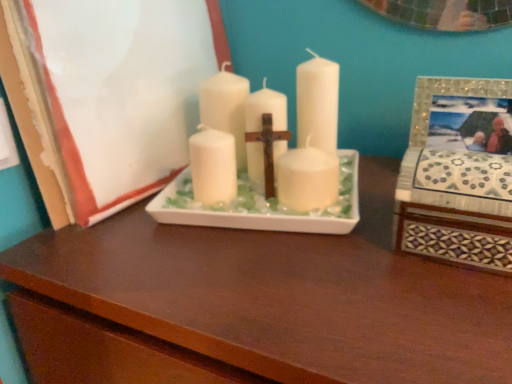
Question: Is point (439, 254) positioned closer to the camera than point (477, 279)?

Choices:
 (A) farther
 (B) closer

Answer: (A)

Question: Is mosaic tile picture frame at right, placed as the first picture frame when sorted from right to left, situated inside matte white tray at center or outside?

Choices:
 (A) inside
 (B) outside

Answer: (B)

Question: Which is nearer to the mosaic tile picture frame at right, which is the second picture frame from left to right?

Choices:
 (A) white matte candle at center
 (B) matte white tray at center
 (C) matte white picture frame at center, placed as the second picture frame when sorted from right to left

Answer: (A)

Question: Estimate the real-world distances between objects in this image. Which object is farther from the matte white tray at center?

Choices:
 (A) white matte candle at center
 (B) mosaic tile picture frame at right, which is the second picture frame from left to right
 (C) matte white picture frame at center, the 1th picture frame in the left-to-right sequence

Answer: (C)